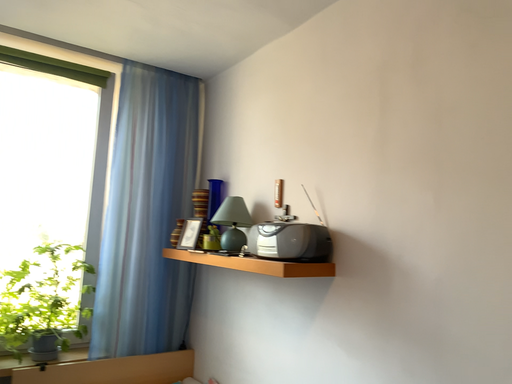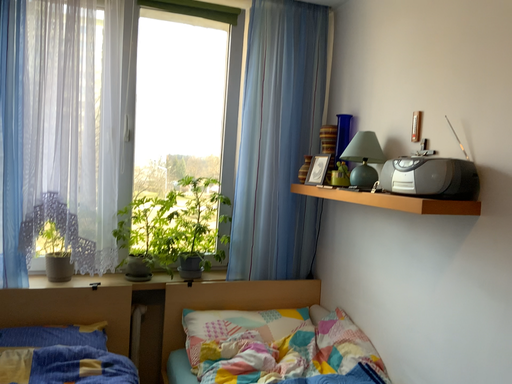
Question: How did the camera likely rotate when shooting the video?

Choices:
 (A) rotated upward
 (B) rotated downward

Answer: (B)